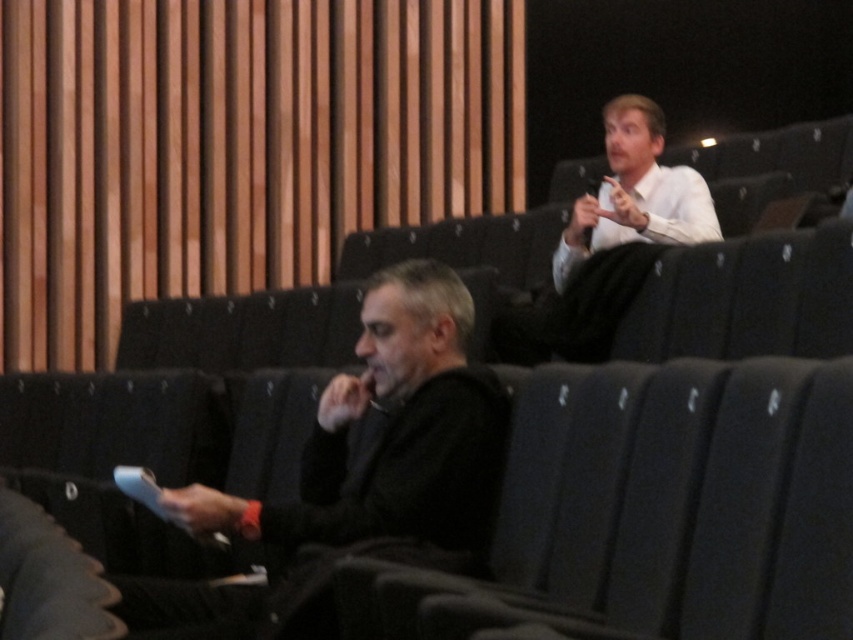
You are sitting in the conference room and notice a black matte jacket at lower left. Where exactly is it positioned in relation to the coordinate system provided?

The black matte jacket at lower left is positioned at coordinates point (390,440).

You are sitting in the conference room and want to hand a note to the person wearing the black matte jacket at lower left and the white glossy shirt at upper right. Which one is closer to your current position if you are sitting in the middle of the room?

The black matte jacket at lower left is closer to your current position because it is to the left of the white glossy shirt at upper right, placing it nearer when sitting in the middle.